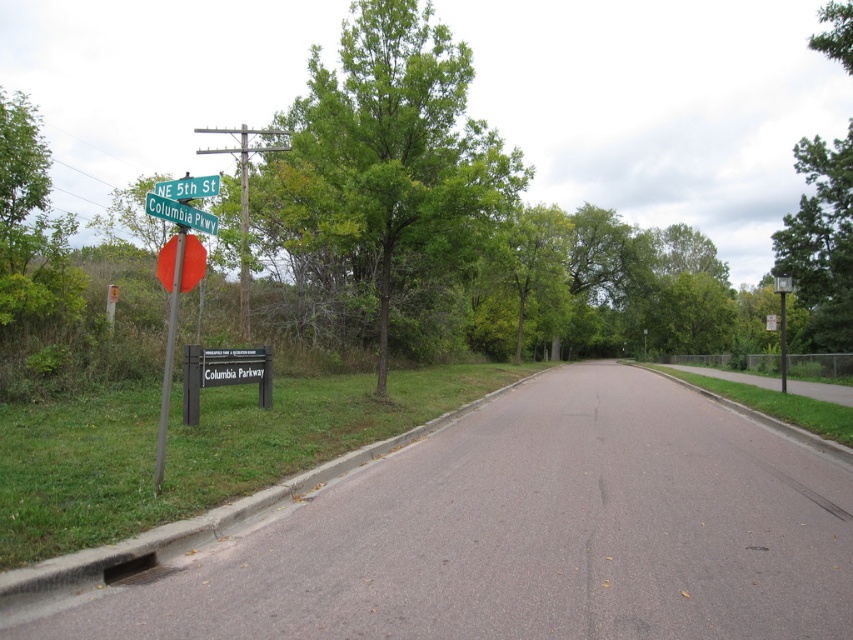
Question: Can you confirm if metallic pole at left is positioned below green metallic street sign at upper left?

Choices:
 (A) yes
 (B) no

Answer: (A)

Question: Estimate the real-world distances between objects in this image. Which object is farther from the green metallic street sign at upper left?

Choices:
 (A) metallic pole at left
 (B) green leafy tree at center

Answer: (B)

Question: Which of these objects is positioned farthest from the green metallic street sign at upper left?

Choices:
 (A) green metallic street sign at upper center
 (B) metallic pole at center
 (C) matte red stop sign at left

Answer: (B)

Question: Which point is farther from the camera taking this photo?

Choices:
 (A) (795, 214)
 (B) (172, 355)

Answer: (A)

Question: Does green leafy tree at center come in front of green leafy tree at upper right?

Choices:
 (A) yes
 (B) no

Answer: (A)

Question: Is black metal sign at lower left below metallic pole at left?

Choices:
 (A) no
 (B) yes

Answer: (B)